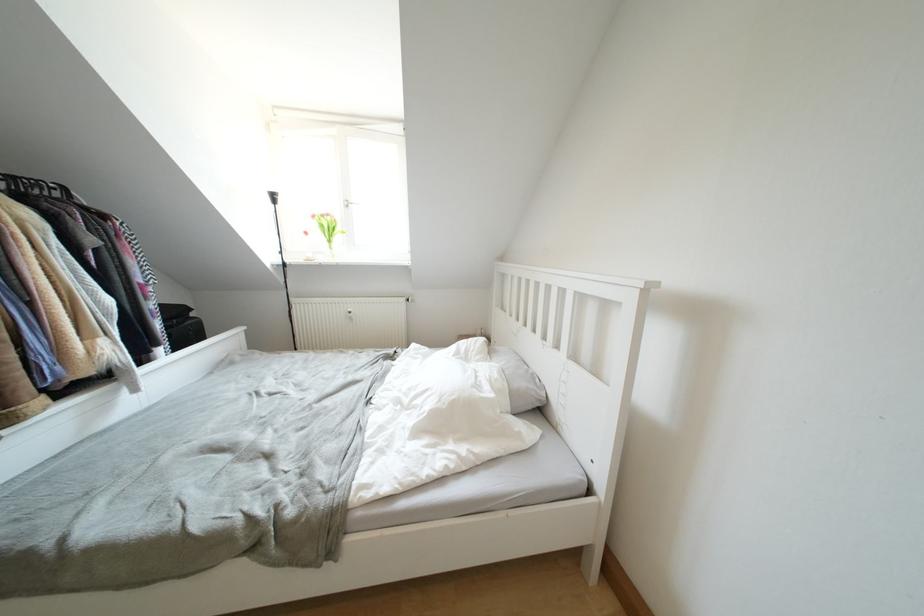
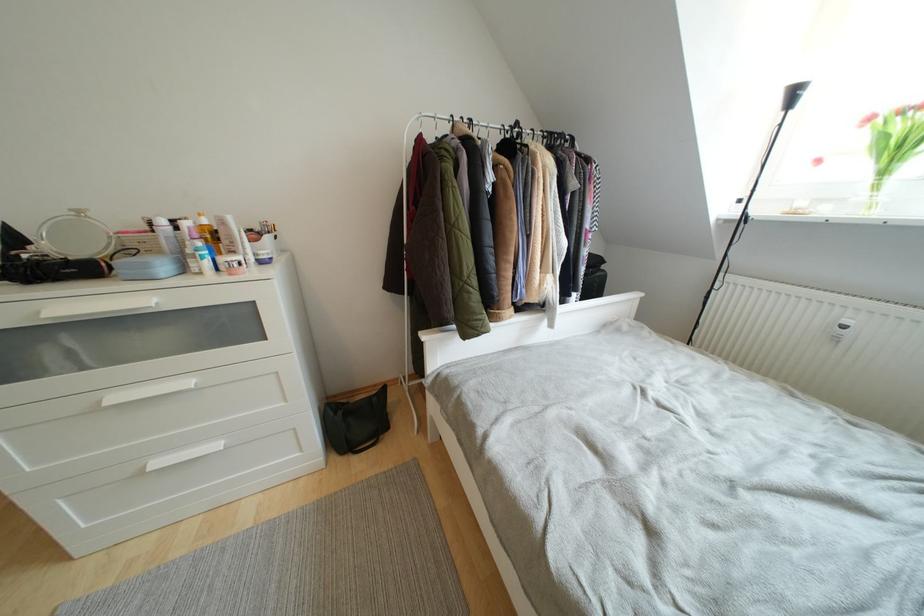
The point at (355, 314) is marked in the first image. Where is the corresponding point in the second image?

(853, 326)